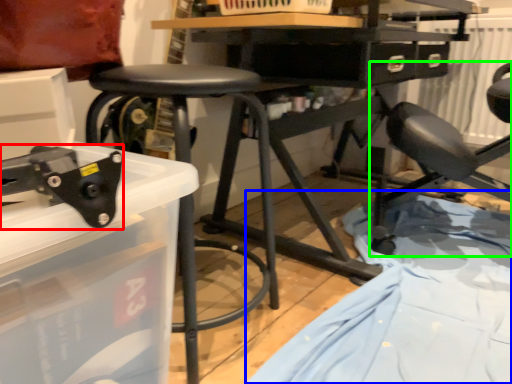
Question: Which object is the farthest from tool (highlighted by a red box)? Choose among these: sheet (highlighted by a blue box) or chair (highlighted by a green box).

Choices:
 (A) sheet
 (B) chair

Answer: (B)